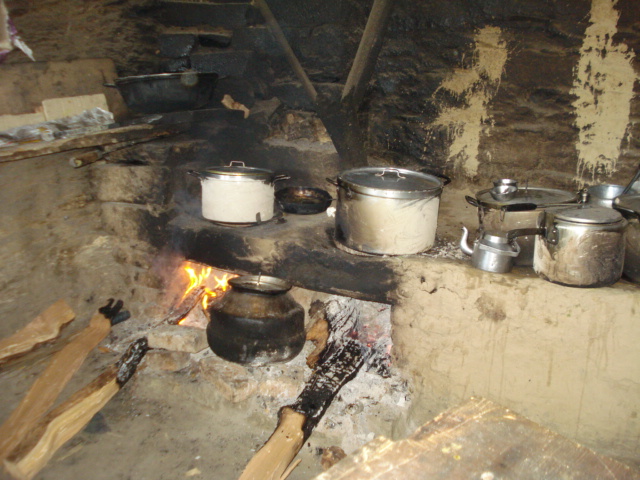
Find the location of a particular element. The height and width of the screenshot is (480, 640). blackened brick wall is located at coordinates (408, 89), (329, 44), (260, 69).